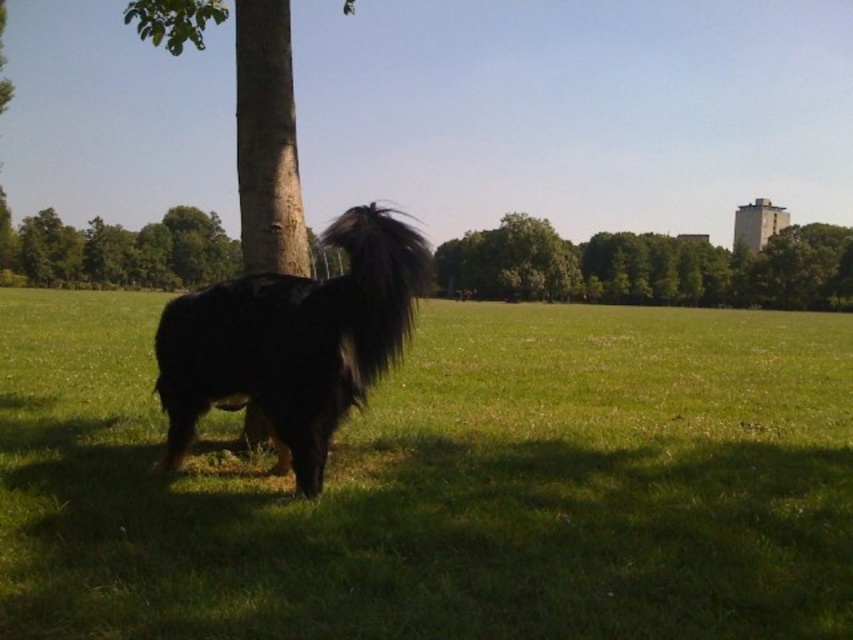
Is black fluffy dog at center smaller than green leafy tree at upper center?

Indeed, black fluffy dog at center has a smaller size compared to green leafy tree at upper center.

Which of these two, black fluffy dog at center or green leafy tree at upper center, stands shorter?

With less height is black fluffy dog at center.

Who is more forward, (189, 384) or (675, 275)?

Positioned in front is point (189, 384).

Identify the location of black fluffy dog at center. This screenshot has height=640, width=853. 293,340.

Which is more to the right, black fur dog at center or green leafy tree at upper center?

green leafy tree at upper center is more to the right.

Between point (611, 417) and point (717, 292), which one is positioned behind?

The point (717, 292) is behind.

Where is `black fur dog at center`? black fur dog at center is located at coordinates (442, 484).

Where is `black fur dog at center`? This screenshot has width=853, height=640. black fur dog at center is located at coordinates [x=442, y=484].

Which is below, green leafy tree at upper center or green leafy tree at upper left?

green leafy tree at upper center is below.

Where is `green leafy tree at upper center`? green leafy tree at upper center is located at coordinates (648, 268).